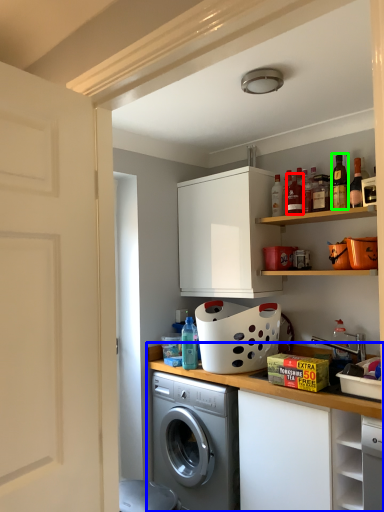
Question: Which object is the farthest from bottle (highlighted by a red box)? Choose among these: countertop (highlighted by a blue box) or bottle (highlighted by a green box).

Choices:
 (A) countertop
 (B) bottle

Answer: (A)